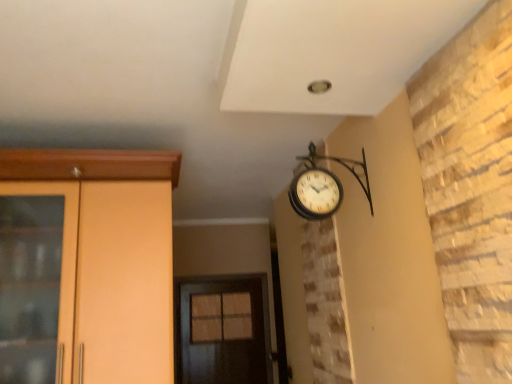
Where is `matte wood cabinet at left`? matte wood cabinet at left is located at coordinates (109, 256).

The width and height of the screenshot is (512, 384). Describe the element at coordinates (109, 256) in the screenshot. I see `matte wood cabinet at left` at that location.

This screenshot has height=384, width=512. Identify the location of matte wood cabinet at left. (109, 256).